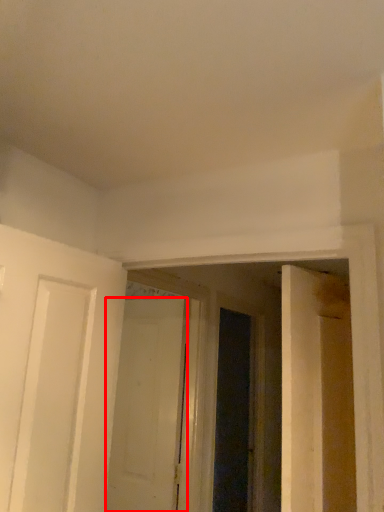
Question: From the image's perspective, what is the correct spatial relationship of door (annotated by the red box) in relation to screen door?

Choices:
 (A) below
 (B) above

Answer: (B)